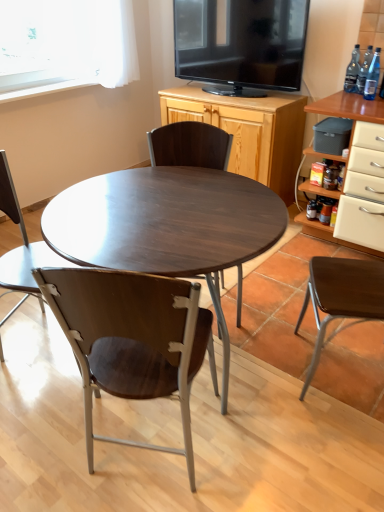
Question: From the image's perspective, is brown wood chair at right, arranged as the 1th chair when viewed from the right, located above or below transparent glass bottle at upper right, placed as the second bottle when sorted from back to front?

Choices:
 (A) above
 (B) below

Answer: (B)

Question: Do you think brown wood chair at right, acting as the fourth chair starting from the left, is within transparent glass bottle at upper right, placed as the second bottle when sorted from back to front, or outside of it?

Choices:
 (A) outside
 (B) inside

Answer: (A)

Question: Which of these objects is positioned closest to the wooden chair at lower left, acting as the fourth chair starting from the right?

Choices:
 (A) transparent glass bottle at upper right, placed as the second bottle when sorted from back to front
 (B) brown wood chair at right, arranged as the 1th chair when viewed from the right
 (C) dark wood chair at center, acting as the 2th chair starting from the right
 (D) matte black tv at upper center
 (E) clear glass bottle at upper right, the 1th bottle from the back

Answer: (C)

Question: Considering the real-world distances, which object is farthest from the wooden chair at center, positioned as the 2th chair in left-to-right order?

Choices:
 (A) dark wood/finish coffee table at center
 (B) brown wood chair at right, acting as the fourth chair starting from the left
 (C) wooden chair at lower left, acting as the fourth chair starting from the right
 (D) matte black tv at upper center
 (E) clear glass bottle at upper right, marked as the 3th bottle in a front-to-back arrangement

Answer: (E)